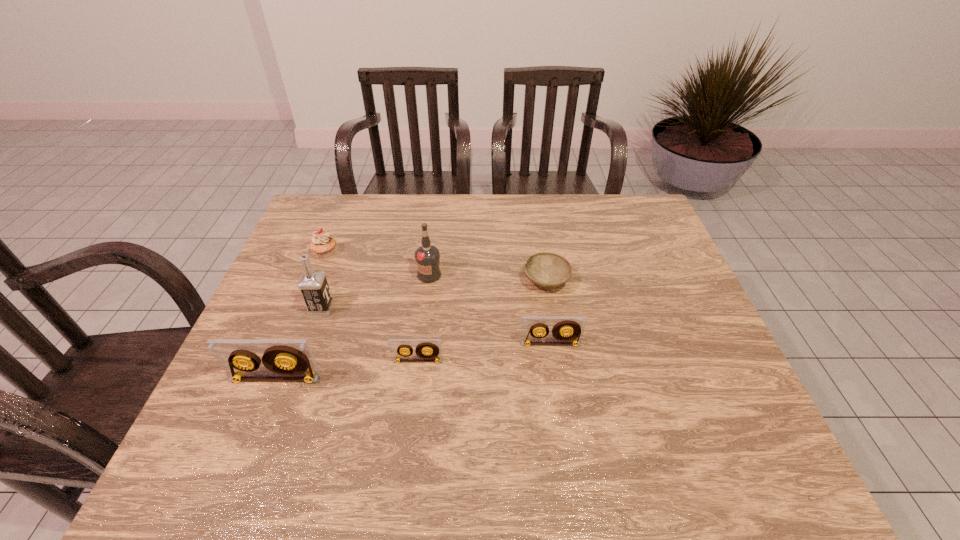
Identify the location of free space at the far edge. Image resolution: width=960 pixels, height=540 pixels. (560, 233).

In order to click on vacant space at the near edge in this screenshot , I will do `click(581, 392)`.

Identify the location of free region at the left edge. (296, 273).

This screenshot has height=540, width=960. In order to click on vacant space at the far left corner in this screenshot , I will do `click(313, 235)`.

Image resolution: width=960 pixels, height=540 pixels. In order to click on vacant region at the near left corner of the desktop in this screenshot , I will do `click(261, 427)`.

Find the location of a particular element. vacant space at the far right corner of the desktop is located at coordinates (637, 225).

Identify the location of empty space that is in between the fifth shortest object and the bowl. (411, 330).

Locate an element on the screen. The height and width of the screenshot is (540, 960). vacant space that's between the left vodka and the farther vodka is located at coordinates (375, 292).

Locate an element on the screen. free space between the farthest object and the rightmost videotape is located at coordinates (438, 299).

Where is `vacant region between the second nearest videotape and the right vodka`? Image resolution: width=960 pixels, height=540 pixels. vacant region between the second nearest videotape and the right vodka is located at coordinates (423, 318).